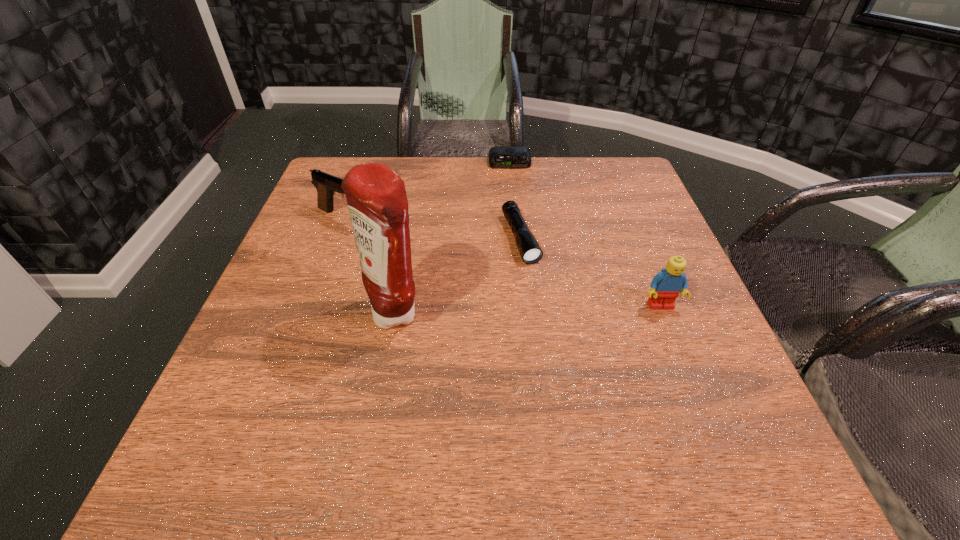
Identify the location of condiment. (376, 197).

The image size is (960, 540). I want to click on the fourth object from right to left, so click(376, 197).

The image size is (960, 540). I want to click on the rightmost object, so click(x=666, y=286).

Where is `the farthest object`? the farthest object is located at coordinates (499, 157).

I want to click on the shortest object, so click(499, 157).

This screenshot has width=960, height=540. Find the location of `flashlight`. flashlight is located at coordinates (528, 247).

This screenshot has width=960, height=540. I want to click on pistol, so click(327, 185).

Image resolution: width=960 pixels, height=540 pixels. Identify the location of vacant space located on the front of the fourth object from right to left. (379, 416).

Where is `vacant space situated on the face of the rightmost object`? vacant space situated on the face of the rightmost object is located at coordinates (702, 409).

Locate an element on the screen. This screenshot has width=960, height=540. vacant region located on the display of the alarm clock is located at coordinates (516, 229).